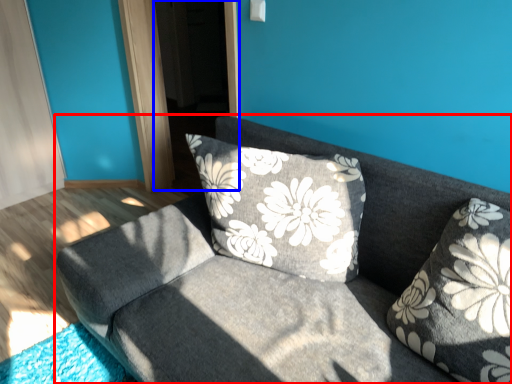
Question: Which object is further to the camera taking this photo, studio couch (highlighted by a red box) or screen door (highlighted by a blue box)?

Choices:
 (A) studio couch
 (B) screen door

Answer: (B)